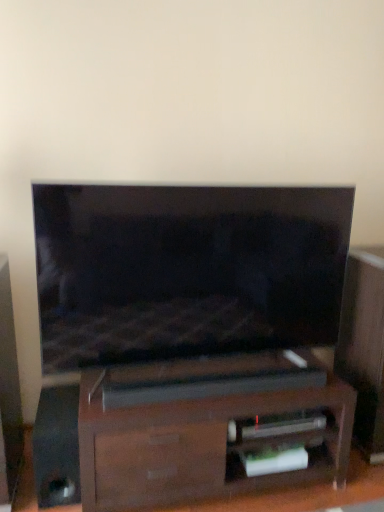
Question: Should I look upward or downward to see black glossy speaker at lower left?

Choices:
 (A) down
 (B) up

Answer: (A)

Question: Does black glossy speaker at lower left have a lesser height compared to matte black tv at center?

Choices:
 (A) yes
 (B) no

Answer: (A)

Question: From a real-world perspective, is black glossy speaker at lower left over matte black tv at center?

Choices:
 (A) yes
 (B) no

Answer: (B)

Question: Is black glossy speaker at lower left positioned in front of matte black tv at center?

Choices:
 (A) no
 (B) yes

Answer: (A)

Question: Does black glossy speaker at lower left have a greater height compared to matte black tv at center?

Choices:
 (A) no
 (B) yes

Answer: (A)

Question: Does black glossy speaker at lower left have a greater width compared to matte black tv at center?

Choices:
 (A) no
 (B) yes

Answer: (B)

Question: Is black glossy speaker at lower left located outside matte black tv at center?

Choices:
 (A) yes
 (B) no

Answer: (A)

Question: Can we say black glossy speaker at lower left lies outside dark wood soundbar at center?

Choices:
 (A) yes
 (B) no

Answer: (A)

Question: Considering the relative positions of black glossy speaker at lower left and dark wood soundbar at center in the image provided, is black glossy speaker at lower left to the left of dark wood soundbar at center from the viewer's perspective?

Choices:
 (A) yes
 (B) no

Answer: (A)

Question: Can you confirm if black glossy speaker at lower left is wider than dark wood soundbar at center?

Choices:
 (A) yes
 (B) no

Answer: (B)

Question: From a real-world perspective, is black glossy speaker at lower left on dark wood soundbar at center?

Choices:
 (A) yes
 (B) no

Answer: (B)

Question: Does black glossy speaker at lower left have a lesser width compared to dark wood soundbar at center?

Choices:
 (A) yes
 (B) no

Answer: (A)

Question: Would you say black glossy speaker at lower left is a long distance from dark wood soundbar at center?

Choices:
 (A) yes
 (B) no

Answer: (B)

Question: From the image's perspective, is dark wood soundbar at center located above matte black tv at center?

Choices:
 (A) no
 (B) yes

Answer: (A)